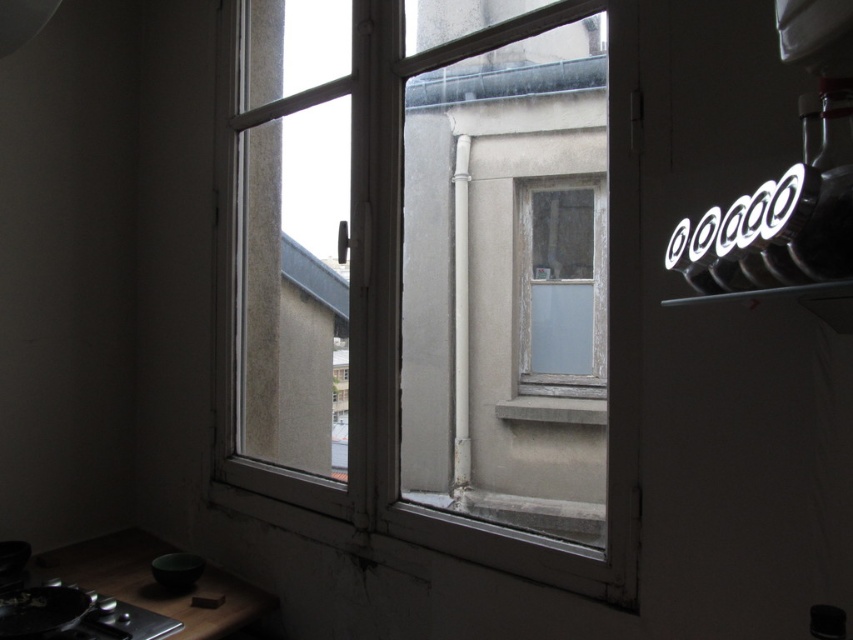
Question: Which point is farther from the camera taking this photo?

Choices:
 (A) (503, 410)
 (B) (798, 252)
 (C) (524, 300)
 (D) (555, 269)

Answer: (A)

Question: Which object is closer to the camera taking this photo?

Choices:
 (A) white frosted glass window at center
 (B) white glossy neon sign at upper right

Answer: (B)

Question: Is white glossy neon sign at upper right to the right of gray concrete window sill at center from the viewer's perspective?

Choices:
 (A) no
 (B) yes

Answer: (B)

Question: Is white frosted glass window at center smaller than gray concrete window sill at center?

Choices:
 (A) yes
 (B) no

Answer: (B)

Question: Does white matte window at center appear on the right side of white glossy neon sign at upper right?

Choices:
 (A) no
 (B) yes

Answer: (A)

Question: Which point is closer to the camera?

Choices:
 (A) (540, 404)
 (B) (463, 200)

Answer: (A)